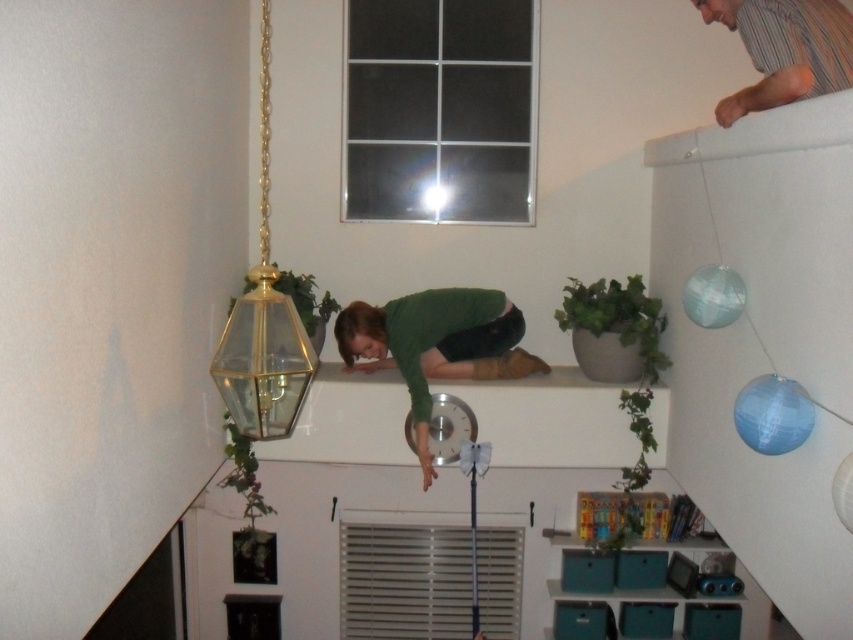
Question: Considering the relative positions of green leafy plant at upper center and green leafy plant at lower left in the image provided, where is green leafy plant at upper center located with respect to green leafy plant at lower left?

Choices:
 (A) above
 (B) below

Answer: (A)

Question: Can you confirm if clear glass pendant light at upper left is thinner than green matte plant pot at center?

Choices:
 (A) no
 (B) yes

Answer: (B)

Question: Which object is positioned closest to the green fabric shirt at center?

Choices:
 (A) green matte plant pot at center
 (B) clear glass pendant light at upper left
 (C) striped fabric shirt at upper right

Answer: (A)

Question: Does green matte plant pot at center have a lesser width compared to green leafy plant at upper center?

Choices:
 (A) no
 (B) yes

Answer: (A)

Question: Based on their relative distances, which object is nearer to the green matte plant pot at center?

Choices:
 (A) green leafy plant at lower left
 (B) green leafy plant at upper center
 (C) green fabric shirt at center
 (D) striped fabric shirt at upper right

Answer: (C)

Question: Which point is farther to the camera?

Choices:
 (A) green matte plant pot at center
 (B) green leafy plant at upper center

Answer: (B)